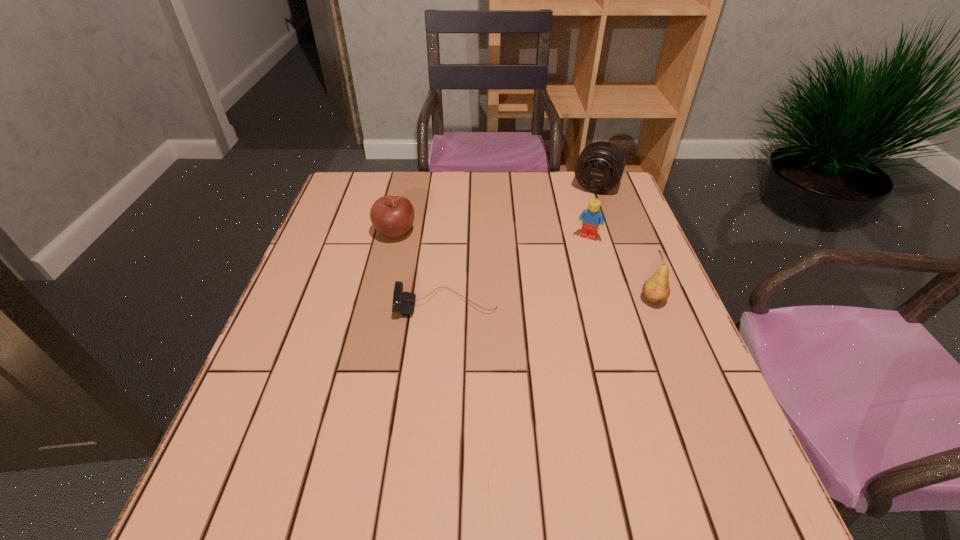
I want to click on vacant region located 0.190m on the front-facing side of the farthest object, so click(x=577, y=233).

This screenshot has width=960, height=540. Find the location of `free spot located on the front-facing side of the farthest object`. free spot located on the front-facing side of the farthest object is located at coordinates (566, 259).

The width and height of the screenshot is (960, 540). In order to click on vacant space located 0.290m on the face of the Lego in this screenshot , I will do `click(552, 318)`.

This screenshot has height=540, width=960. What are the coordinates of `vacant space located on the face of the Lego` in the screenshot? It's located at (541, 344).

This screenshot has height=540, width=960. What are the coordinates of `blank space located 0.220m on the face of the Lego` in the screenshot? It's located at 561,298.

Where is `free space located 0.310m on the side of the apple with the unique marking`? free space located 0.310m on the side of the apple with the unique marking is located at coordinates (512, 283).

This screenshot has width=960, height=540. Identify the location of free space located 0.280m on the side of the apple with the unique marking. (501, 278).

Identify the location of vacant region located on the side of the apple with the unique marking. (480, 269).

Identify the location of object positioned at the far edge. This screenshot has width=960, height=540. (600, 166).

Locate an element on the screen. The image size is (960, 540). object present at the left edge is located at coordinates (392, 216).